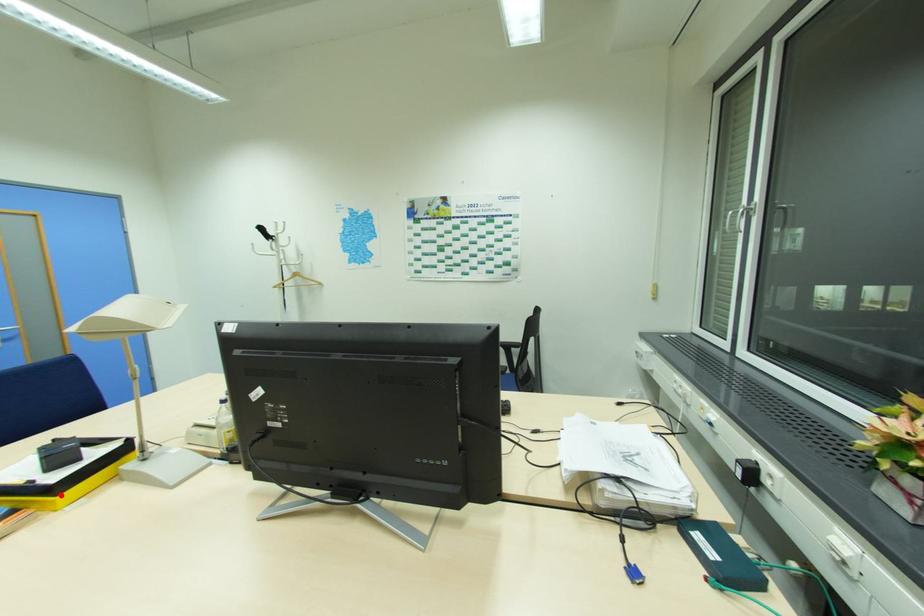
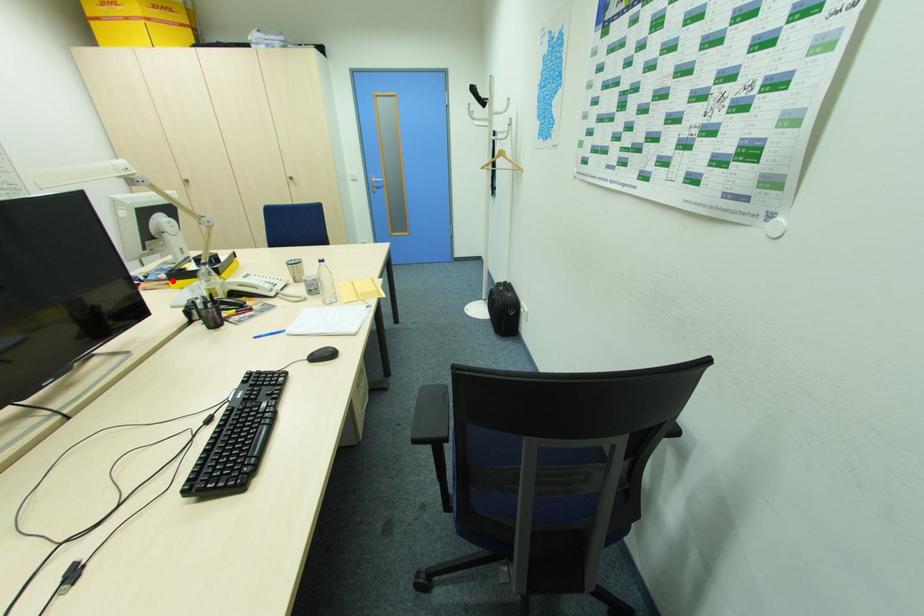
I am providing you with two images of the same scene from different viewpoints. A red point is marked on the first image and another point is marked on the second image. Does the point marked in image1 correspond to the same location as the one in image2?

Yes